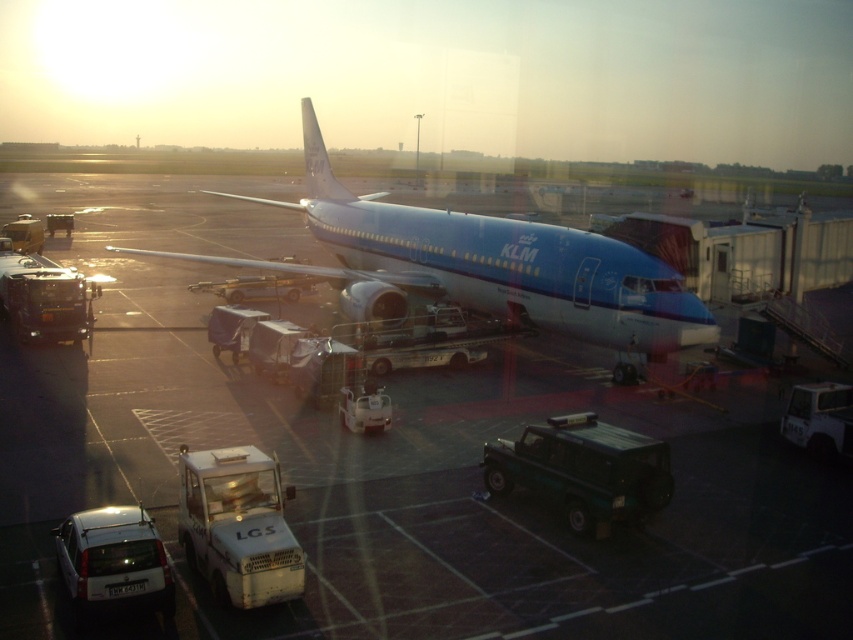
Question: Among these objects, which one is nearest to the camera?

Choices:
 (A) blue polished airplane at center
 (B) blue glossy airplane at center

Answer: (A)

Question: Where is blue polished airplane at center located in relation to blue glossy airplane at center in the image?

Choices:
 (A) left
 (B) right

Answer: (B)

Question: Does blue polished airplane at center appear under blue glossy airplane at center?

Choices:
 (A) yes
 (B) no

Answer: (A)

Question: Is blue polished airplane at center in front of blue glossy airplane at center?

Choices:
 (A) no
 (B) yes

Answer: (B)